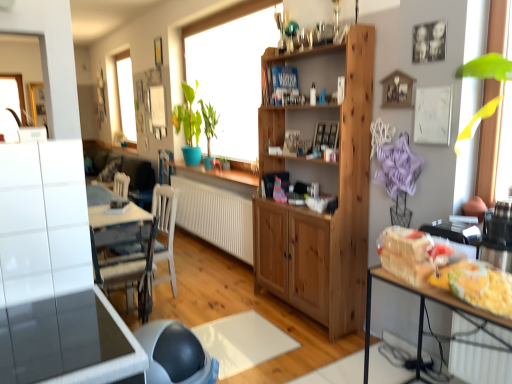
Question: Is white textured radiator at center positioned with its back to wooden table at right, positioned as the 1th table in right-to-left order?

Choices:
 (A) yes
 (B) no

Answer: (B)

Question: Can you confirm if white textured radiator at center is bigger than wooden table at right, the 2th table positioned from the front?

Choices:
 (A) yes
 (B) no

Answer: (B)

Question: From a real-world perspective, is white textured radiator at center located higher than wooden table at right, positioned as the 1th table in right-to-left order?

Choices:
 (A) no
 (B) yes

Answer: (B)

Question: Can you confirm if white textured radiator at center is thinner than wooden table at right, the 2th table positioned from the front?

Choices:
 (A) no
 (B) yes

Answer: (B)

Question: Is white textured radiator at center wider than wooden table at right, the first table in the back-to-front sequence?

Choices:
 (A) no
 (B) yes

Answer: (A)

Question: Is white matte chair at center wider or thinner than green glossy plant at center?

Choices:
 (A) thin
 (B) wide

Answer: (B)

Question: From the image's perspective, is white matte chair at center positioned above or below green glossy plant at center?

Choices:
 (A) below
 (B) above

Answer: (A)

Question: Considering the positions of white matte chair at center and green glossy plant at center in the image, is white matte chair at center bigger or smaller than green glossy plant at center?

Choices:
 (A) small
 (B) big

Answer: (A)

Question: Considering the relative positions of white matte chair at center and green glossy plant at center in the image provided, is white matte chair at center to the left or to the right of green glossy plant at center?

Choices:
 (A) right
 (B) left

Answer: (B)

Question: From a real-world perspective, is white textured radiator at center positioned above or below white matte chair at center?

Choices:
 (A) above
 (B) below

Answer: (B)

Question: From the image's perspective, is white textured radiator at center above or below white matte chair at center?

Choices:
 (A) below
 (B) above

Answer: (B)

Question: Relative to white matte chair at center, is white textured radiator at center in front or behind?

Choices:
 (A) front
 (B) behind

Answer: (B)

Question: Do you think white textured radiator at center is within white matte chair at center, or outside of it?

Choices:
 (A) inside
 (B) outside

Answer: (B)

Question: Which is correct: yellow matte cheese at lower right, which ranks as the 2th food in top-to-bottom order, is inside natural wood cabinet at center, or outside of it?

Choices:
 (A) outside
 (B) inside

Answer: (A)

Question: Based on their sizes in the image, would you say yellow matte cheese at lower right, which appears as the first food when ordered from the bottom, is bigger or smaller than natural wood cabinet at center?

Choices:
 (A) big
 (B) small

Answer: (B)